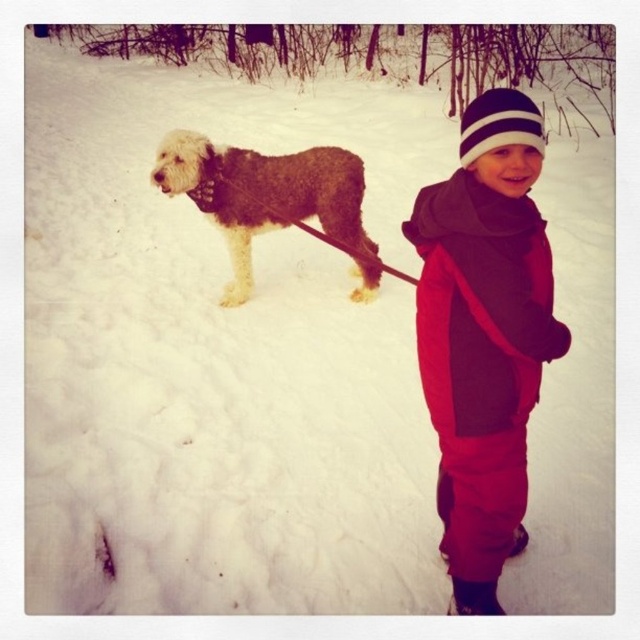
Question: Can you confirm if fuzzy brown dog at center is wider than white striped knit hat at upper center?

Choices:
 (A) no
 (B) yes

Answer: (B)

Question: Which of the following is the farthest from the observer?

Choices:
 (A) (448, 563)
 (B) (500, 120)

Answer: (A)

Question: Is fuzzy brown dog at center to the right of white striped knit hat at upper center from the viewer's perspective?

Choices:
 (A) no
 (B) yes

Answer: (A)

Question: Which of the following is the closest to the observer?

Choices:
 (A) click(467, 166)
 (B) click(488, 500)
 (C) click(307, 170)

Answer: (A)

Question: Does red fleece jacket at center have a greater width compared to fuzzy brown dog at center?

Choices:
 (A) no
 (B) yes

Answer: (A)

Question: Which object is closer to the camera taking this photo?

Choices:
 (A) white striped knit hat at upper center
 (B) red fleece jacket at center

Answer: (B)